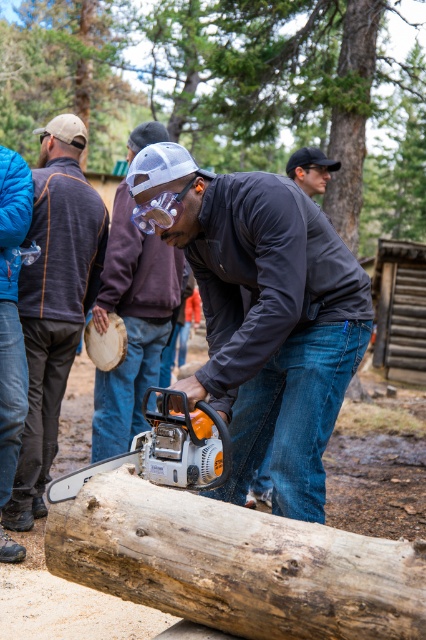
You are a safety inspector observing the scene. You notice the matte black chainsaw at center and the dark gray jacket at center. According to safety protocols, the chainsaw should be kept at least 1 meter away from any clothing. Is the current positioning compliant with this rule?

The matte black chainsaw at center is positioned on the left side of dark gray jacket at center. Since the description does not specify the distance between them, we cannot confirm compliance with the 1 meter safety rule. Further measurement is required.

Looking at this image, you are a drone operator tasked with capturing aerial footage of the scene. The drone is currently at a high altitude and needs to adjust its camera to focus on the matte black chainsaw at center. What are the coordinates where the drone should direct its camera?

The drone should direct its camera to the coordinates point at point at point at point at point at point at point at point at point at point at point at point at point at point at point at point at point at point at point at point at point at point at point at point at point at point at point at point at point at point at point at point at point at point at point at point at point at point at point at point at point at point at point at point at point at point at point at point at point at point at point at

You are a safety inspector checking the workspace. The chainsaw is on the weathered brown log at center. The dark gray jacket at center is lying on the ground near the log. According to safety protocols, tools must be kept at least 3 feet away from any personal items. Is the chainsaw positioned safely?

The weathered brown log at center is larger than the dark gray jacket at center. However, the question is about distance between the chainsaw and the jacket. Since the objects description only provides size comparison, not distance, I cannot determine if the chainsaw is positioned safely based on the given information.